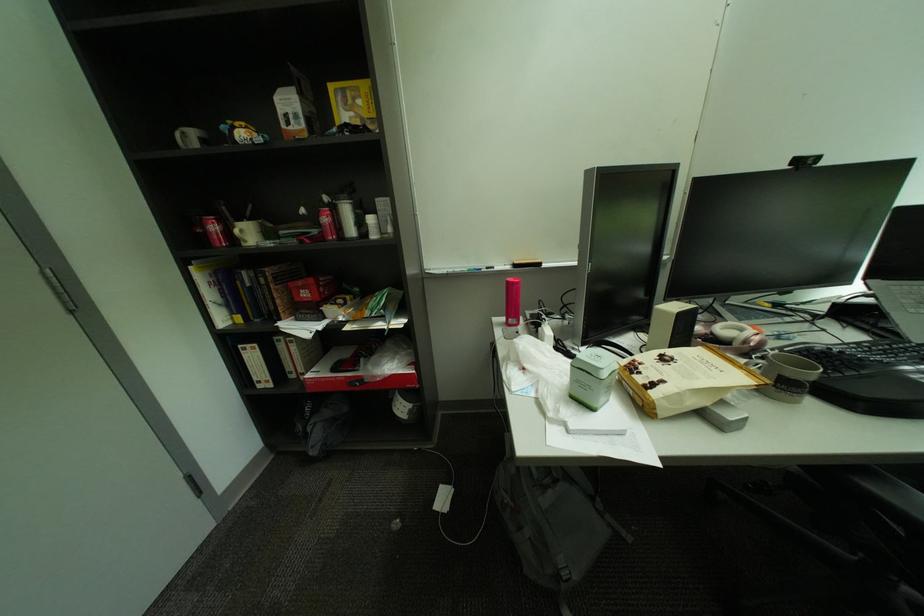
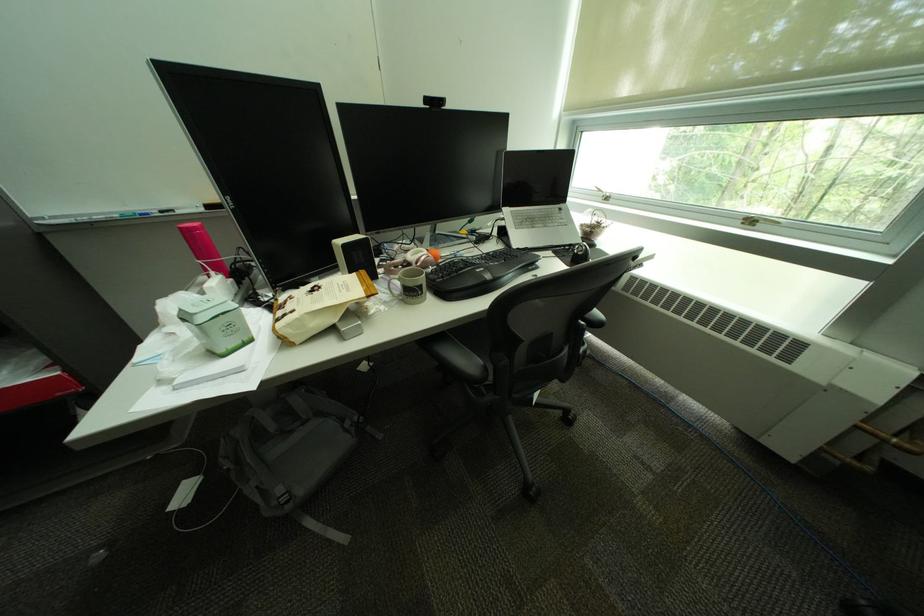
Question: I am providing you with two images of the same scene from different viewpoints. After the viewpoint changes to image2, which objects are now occluded?

Choices:
 (A) silver laptop
 (B) grey mug handle
 (C) black computer keyboard
 (D) none of these

Answer: (D)